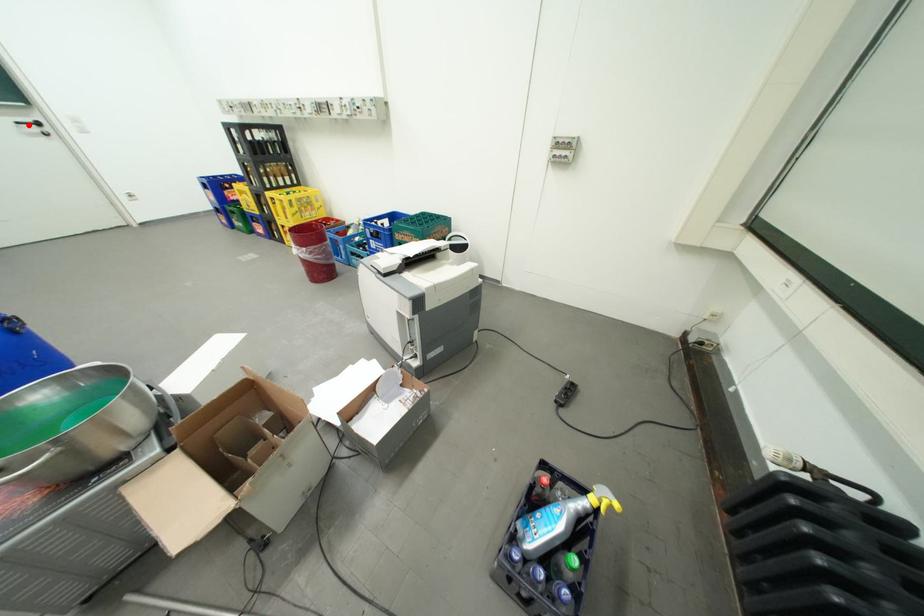
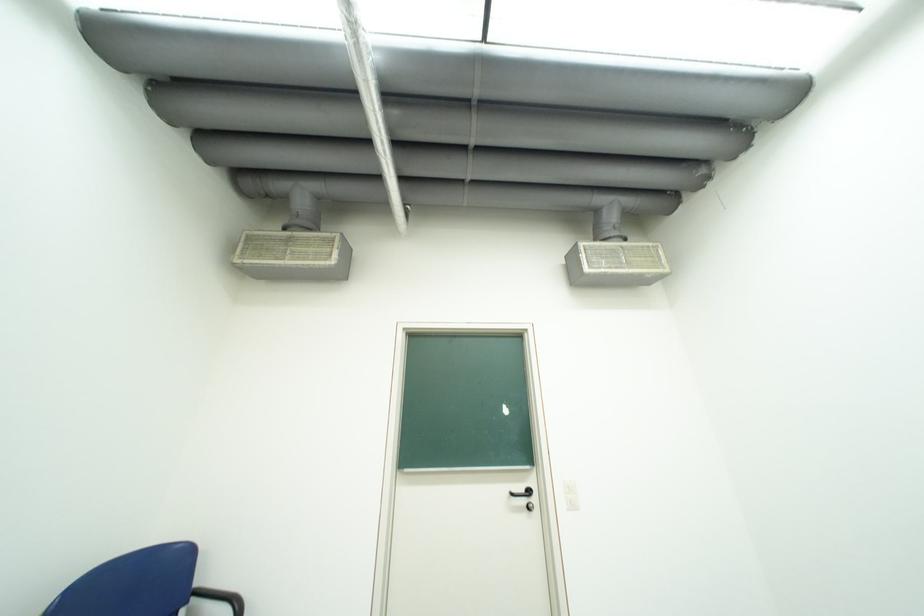
Question: I am providing you with two images of the same scene from different viewpoints. Given a red point in image1, look at the same physical point in image2. Is it:

Choices:
 (A) Closer to the viewpoint
 (B) Farther from the viewpoint

Answer: (A)